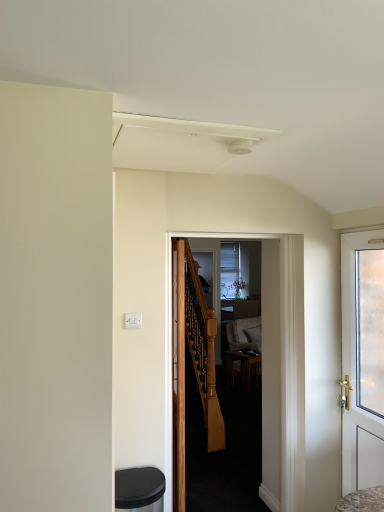
Question: In which direction should I rotate to look at wooden door at center, the third door viewed from the right?

Choices:
 (A) left
 (B) right

Answer: (A)

Question: Is wooden door at center, which appears as the 2th door when viewed from the left, next to white glossy door at right, which ranks as the 3th door in left-to-right order, and touching it?

Choices:
 (A) yes
 (B) no

Answer: (B)

Question: Can you confirm if wooden door at center, marked as the 2th door in a right-to-left arrangement, is positioned to the right of white glossy door at right, which ranks as the 3th door in left-to-right order?

Choices:
 (A) no
 (B) yes

Answer: (A)

Question: Can you confirm if wooden door at center, which appears as the 2th door when viewed from the left, is smaller than white glossy door at right, which ranks as the 3th door in left-to-right order?

Choices:
 (A) yes
 (B) no

Answer: (B)

Question: Is wooden door at center, marked as the 2th door in a right-to-left arrangement, positioned in front of white glossy door at right, which ranks as the 3th door in left-to-right order?

Choices:
 (A) no
 (B) yes

Answer: (A)

Question: Considering the relative positions of wooden door at center, which appears as the 2th door when viewed from the left, and white glossy door at right, which ranks as the 3th door in left-to-right order, in the image provided, is wooden door at center, which appears as the 2th door when viewed from the left, behind white glossy door at right, which ranks as the 3th door in left-to-right order,?

Choices:
 (A) no
 (B) yes

Answer: (B)

Question: Considering the relative sizes of wooden door at center, which appears as the 2th door when viewed from the left, and white glossy door at right, which ranks as the 3th door in left-to-right order, in the image provided, is wooden door at center, which appears as the 2th door when viewed from the left, bigger than white glossy door at right, which ranks as the 3th door in left-to-right order,?

Choices:
 (A) yes
 (B) no

Answer: (A)

Question: Is wooden door at center, which appears as the 2th door when viewed from the left, not inside brown wooden table at center?

Choices:
 (A) yes
 (B) no

Answer: (A)

Question: Considering the relative positions of wooden door at center, which appears as the 2th door when viewed from the left, and brown wooden table at center in the image provided, is wooden door at center, which appears as the 2th door when viewed from the left, to the right of brown wooden table at center from the viewer's perspective?

Choices:
 (A) no
 (B) yes

Answer: (A)

Question: Is wooden door at center, which appears as the 2th door when viewed from the left, further to camera compared to brown wooden table at center?

Choices:
 (A) yes
 (B) no

Answer: (B)

Question: Is wooden door at center, marked as the 2th door in a right-to-left arrangement, aimed at brown wooden table at center?

Choices:
 (A) yes
 (B) no

Answer: (B)

Question: From a real-world perspective, is wooden door at center, marked as the 2th door in a right-to-left arrangement, below brown wooden table at center?

Choices:
 (A) yes
 (B) no

Answer: (B)

Question: Is wooden door at center, marked as the 2th door in a right-to-left arrangement, oriented away from brown wooden table at center?

Choices:
 (A) yes
 (B) no

Answer: (B)

Question: Is wooden door at center, the third door viewed from the right, next to brown wooden table at center?

Choices:
 (A) no
 (B) yes

Answer: (A)